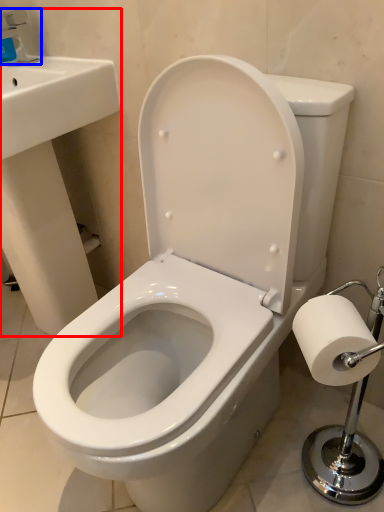
Question: Which object is closer to the camera taking this photo, sink (highlighted by a red box) or faucet (highlighted by a blue box)?

Choices:
 (A) sink
 (B) faucet

Answer: (A)